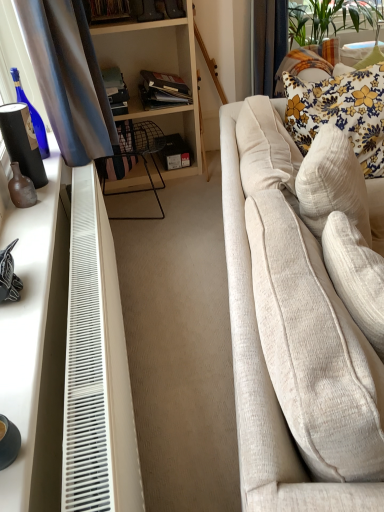
Question: From the image's perspective, is white matte desk at left located above or below floral fabric pillow at upper right?

Choices:
 (A) below
 (B) above

Answer: (A)

Question: From their relative heights in the image, would you say white matte desk at left is taller or shorter than floral fabric pillow at upper right?

Choices:
 (A) short
 (B) tall

Answer: (A)

Question: Based on their relative distances, which object is farther from the matte black vase at left?

Choices:
 (A) brown matte vase at left
 (B) black matte box at center
 (C) floral fabric pillow at upper right
 (D) beige fabric couch at right
 (E) white plastic radiator at lower left

Answer: (C)

Question: Considering the real-world distances, which object is farthest from the black matte box at center?

Choices:
 (A) white plastic radiator at lower left
 (B) floral fabric pillow at upper right
 (C) white matte desk at left
 (D) floral fabric pillow at upper right
 (E) matte black vase at left

Answer: (C)